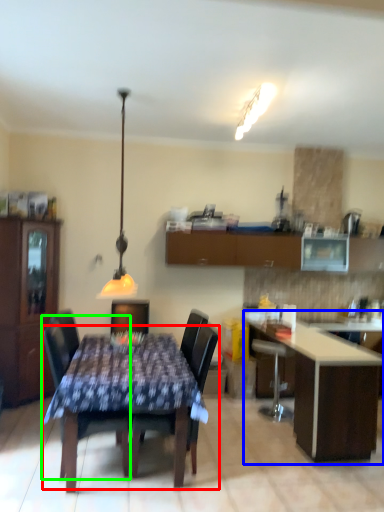
Question: Based on their relative distances, which object is nearer to kitchen & dining room table (highlighted by a red box)? Choose from table (highlighted by a blue box) and chair (highlighted by a green box).

Choices:
 (A) table
 (B) chair

Answer: (B)